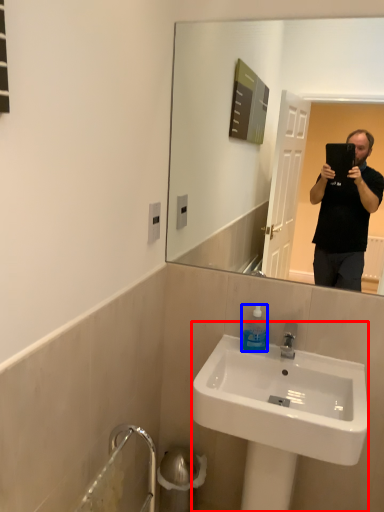
Question: Which object appears farthest to the camera in this image, sink (highlighted by a red box) or bottle (highlighted by a blue box)?

Choices:
 (A) sink
 (B) bottle

Answer: (B)